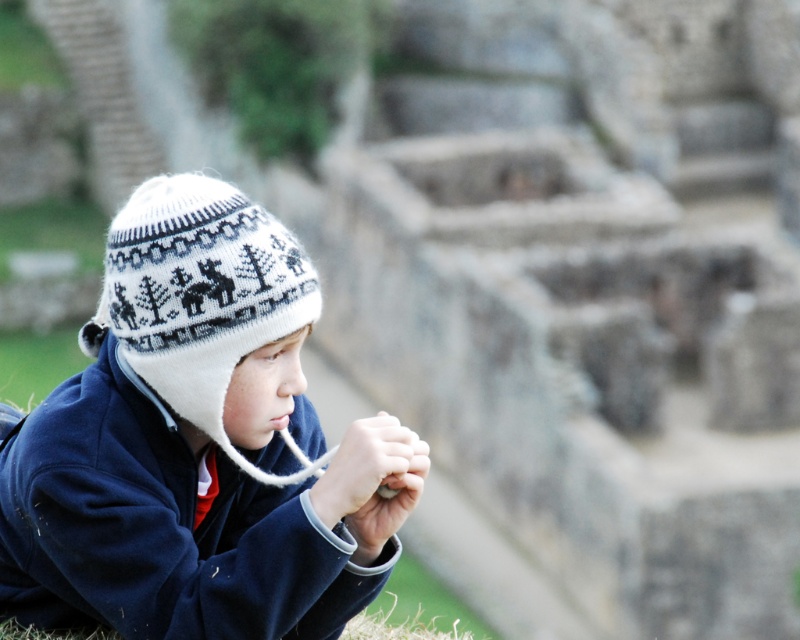
Question: Is white knitted hat at center further to the viewer compared to white knitted hat at left?

Choices:
 (A) yes
 (B) no

Answer: (B)

Question: Does white knitted hat at center have a larger size compared to white knitted hat at left?

Choices:
 (A) yes
 (B) no

Answer: (A)

Question: Which point is farther to the camera?

Choices:
 (A) (396, 502)
 (B) (178, 262)

Answer: (A)

Question: Is white knitted hat at center smaller than white knitted hat at left?

Choices:
 (A) yes
 (B) no

Answer: (B)